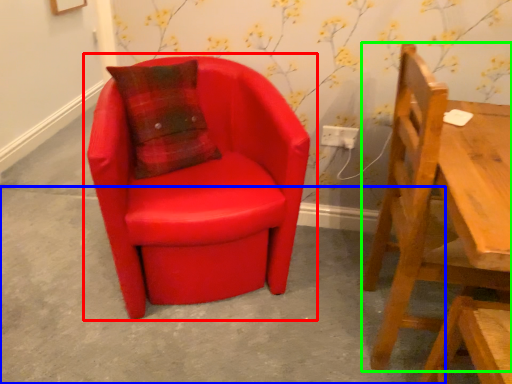
Question: Which object is the farthest from chair (highlighted by a red box)? Choose among these: concrete (highlighted by a blue box) or chair (highlighted by a green box).

Choices:
 (A) concrete
 (B) chair

Answer: (B)